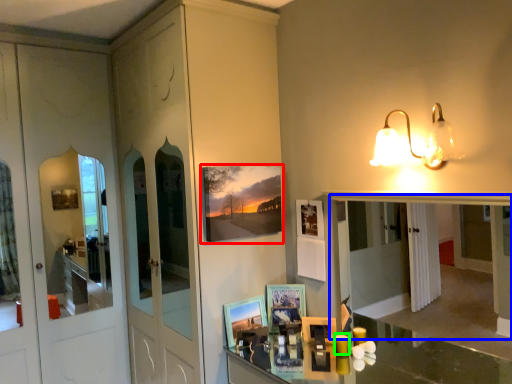
Question: Which object is the closest to the picture frame (highlighted by a red box)? Choose among these: mirror (highlighted by a blue box) or candle (highlighted by a green box).

Choices:
 (A) mirror
 (B) candle

Answer: (B)